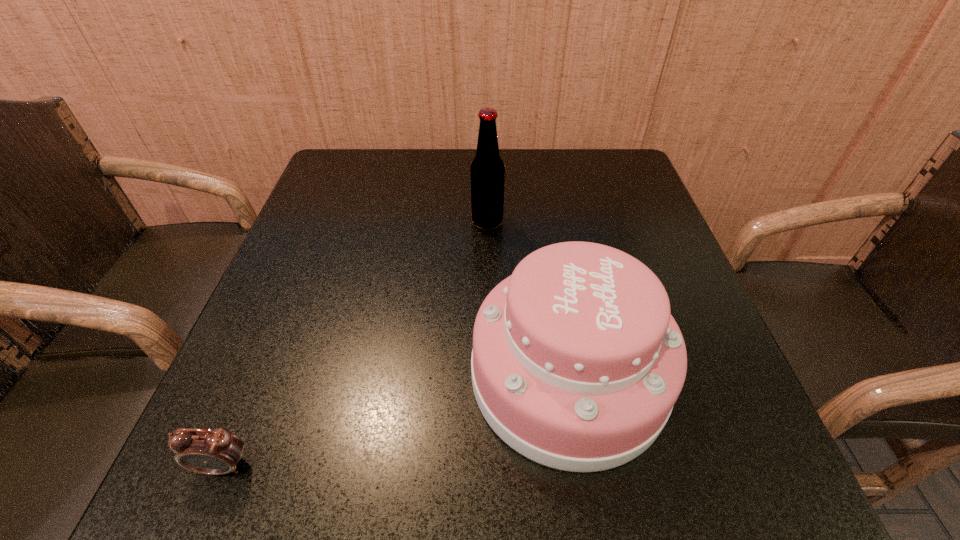
At what (x,y) coordinates should I click in order to perform the action: click on free space between the shortest object and the farthest object. Please return your answer as a coordinate pair (x, y). The height and width of the screenshot is (540, 960). Looking at the image, I should click on tap(355, 343).

What are the coordinates of `free spot between the leftmost object and the beer bottle` in the screenshot? It's located at click(355, 343).

At what (x,y) coordinates should I click in order to perform the action: click on unoccupied position between the second tallest object and the shortest object. Please return your answer as a coordinate pair (x, y). This screenshot has width=960, height=540. Looking at the image, I should click on (396, 421).

At what (x,y) coordinates should I click in order to perform the action: click on free point between the shortest object and the birthday cake. Please return your answer as a coordinate pair (x, y). The image size is (960, 540). Looking at the image, I should click on (396, 421).

Locate an element on the screen. The image size is (960, 540). vacant space that's between the shortest object and the second shortest object is located at coordinates click(396, 421).

In order to click on free space between the leftmost object and the birthday cake in this screenshot , I will do `click(396, 421)`.

Choose which object is the nearest neighbor to the second tallest object. Please provide its 2D coordinates. Your answer should be formatted as a tuple, i.e. [(x, y)], where the tuple contains the x and y coordinates of a point satisfying the conditions above.

[(487, 172)]

Identify which object is located as the nearest to the farthest object. Please provide its 2D coordinates. Your answer should be formatted as a tuple, i.e. [(x, y)], where the tuple contains the x and y coordinates of a point satisfying the conditions above.

[(577, 362)]

Locate an element on the screen. Image resolution: width=960 pixels, height=540 pixels. vacant space that satisfies the following two spatial constraints: 1. on the front side of the farthest object; 2. on the left side of the second shortest object is located at coordinates (490, 376).

I want to click on vacant space that satisfies the following two spatial constraints: 1. on the front side of the farthest object; 2. on the right side of the second tallest object, so click(x=490, y=376).